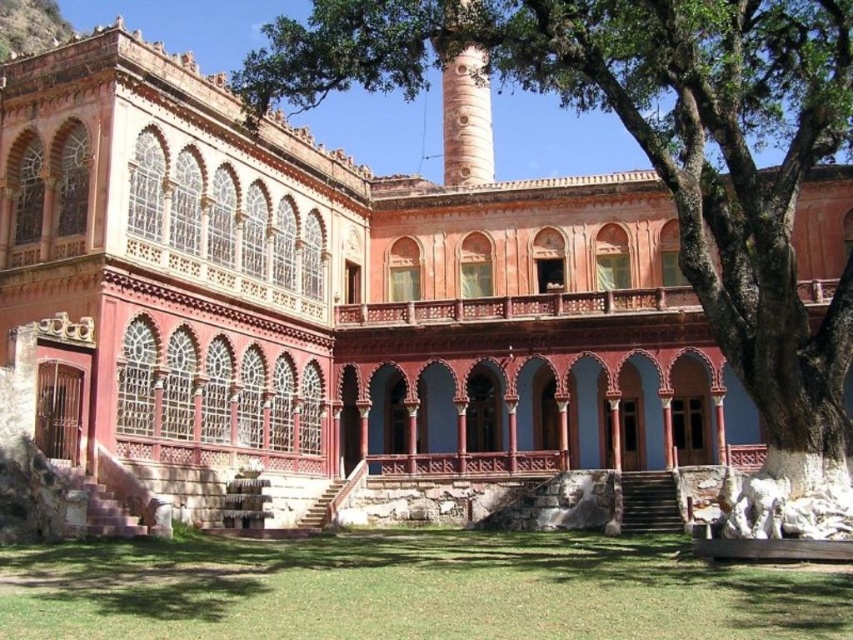
Based on the photo, you are standing in front of the grand building and notice a green leafy tree at upper center and a green grass at lower center. Which one is located to the right of the other?

The green leafy tree at upper center is positioned on the right side of green grass at lower center.

You are standing in front of the grand building and notice the green leafy tree at upper center and the green grass at lower center. Which of these two elements appears bigger in the image?

The green leafy tree at upper center appears bigger than the green grass at lower center in the image.

You are standing in front of the grand building and notice the green leafy tree at upper center and the green grass at lower center. Which object is taller?

The green leafy tree at upper center is taller than the green grass at lower center.